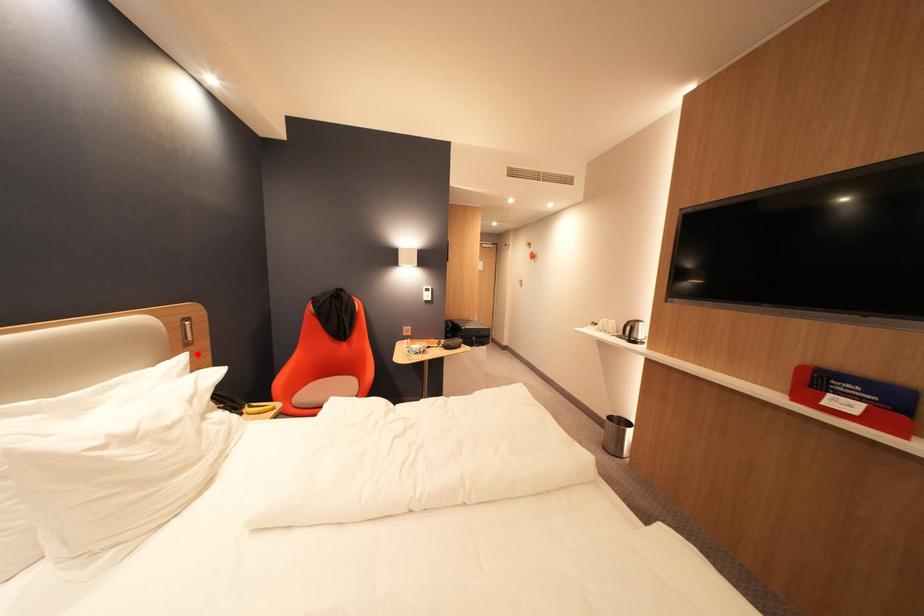
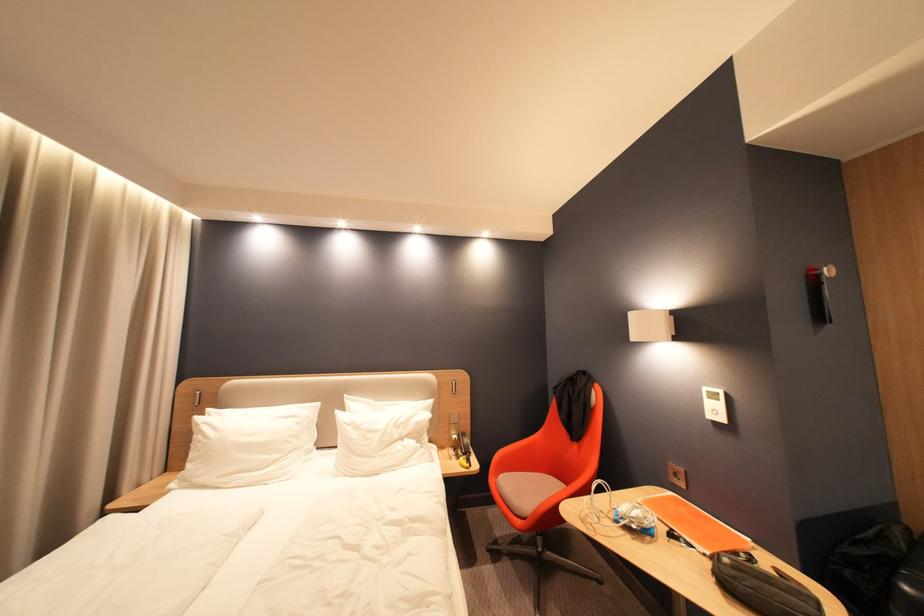
The point at the highlighted location is marked in the first image. Where is the corresponding point in the second image?

(443, 400)